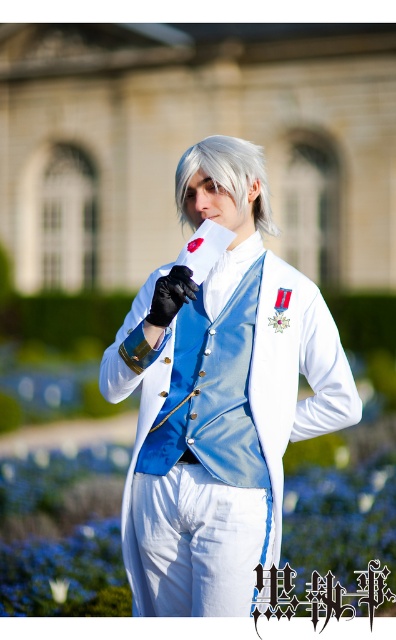
Who is taller, white glossy vest at center or slick silver hair at center?

Standing taller between the two is white glossy vest at center.

Can you confirm if white glossy vest at center is smaller than slick silver hair at center?

Indeed, white glossy vest at center has a smaller size compared to slick silver hair at center.

What do you see at coordinates (295, 374) in the screenshot?
I see `white glossy vest at center` at bounding box center [295, 374].

At what (x,y) coordinates should I click in order to perform the action: click on white glossy vest at center. Please return your answer as a coordinate pair (x, y). Looking at the image, I should click on (295, 374).